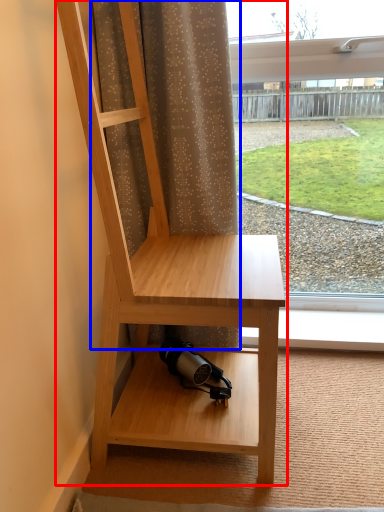
Question: Which object appears farthest to the camera in this image, furniture (highlighted by a red box) or curtain (highlighted by a blue box)?

Choices:
 (A) furniture
 (B) curtain

Answer: (B)